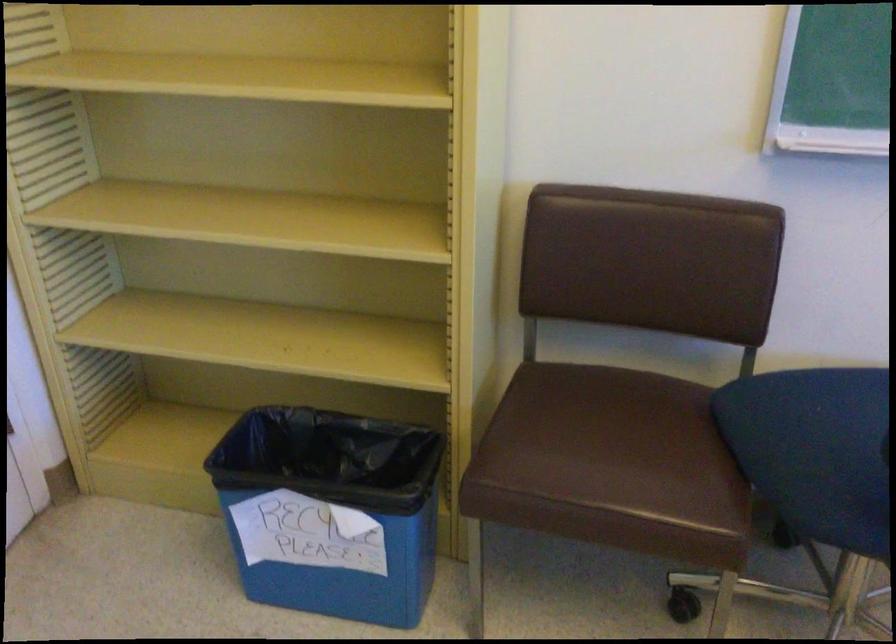
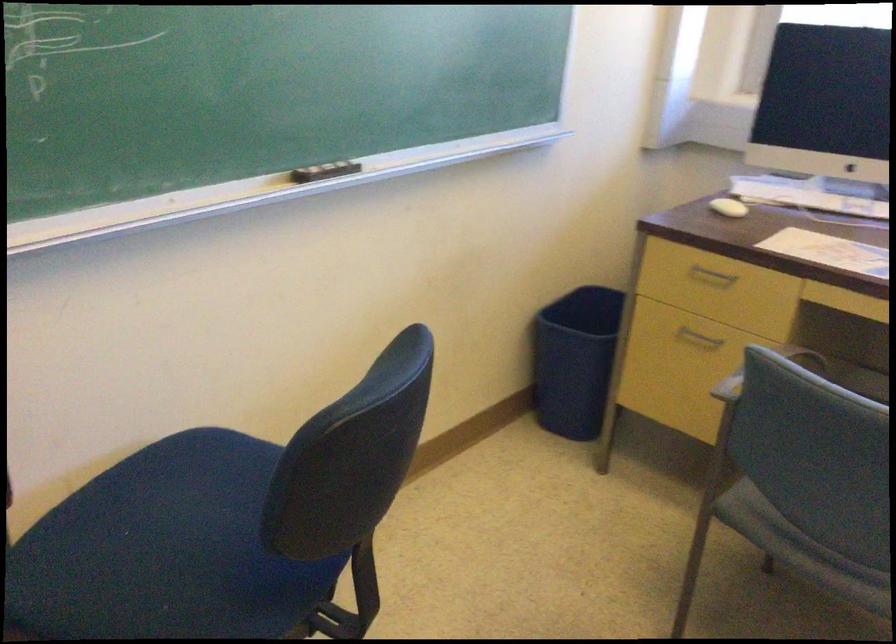
The point at (823, 424) is marked in the first image. Where is the corresponding point in the second image?

(165, 550)